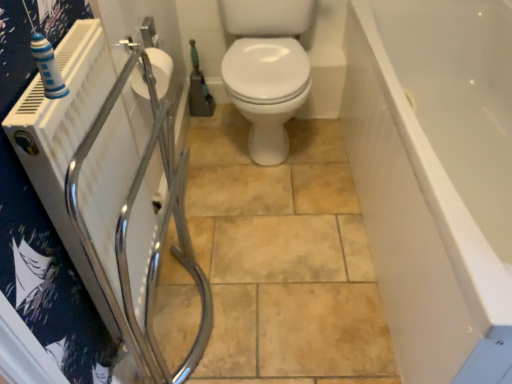
Question: Is green rubber garden hose at center oriented towards white matte toilet paper at upper left?

Choices:
 (A) no
 (B) yes

Answer: (B)

Question: From a real-world perspective, is green rubber garden hose at center on top of white matte toilet paper at upper left?

Choices:
 (A) no
 (B) yes

Answer: (A)

Question: Would you consider green rubber garden hose at center to be distant from white matte toilet paper at upper left?

Choices:
 (A) yes
 (B) no

Answer: (B)

Question: From the image's perspective, is green rubber garden hose at center on top of white matte toilet paper at upper left?

Choices:
 (A) yes
 (B) no

Answer: (A)

Question: Considering the relative sizes of green rubber garden hose at center and white matte toilet paper at upper left in the image provided, is green rubber garden hose at center taller than white matte toilet paper at upper left?

Choices:
 (A) yes
 (B) no

Answer: (A)

Question: Considering the relative sizes of green rubber garden hose at center and white matte toilet paper at upper left in the image provided, is green rubber garden hose at center thinner than white matte toilet paper at upper left?

Choices:
 (A) no
 (B) yes

Answer: (B)

Question: Does white matte toilet paper at upper left lie in front of white glossy bathtub at right?

Choices:
 (A) yes
 (B) no

Answer: (B)

Question: Can you confirm if white matte toilet paper at upper left is positioned to the right of white glossy bathtub at right?

Choices:
 (A) no
 (B) yes

Answer: (A)

Question: From the image's perspective, is white matte toilet paper at upper left under white glossy bathtub at right?

Choices:
 (A) yes
 (B) no

Answer: (B)

Question: From the image's perspective, is white matte toilet paper at upper left above white glossy bathtub at right?

Choices:
 (A) no
 (B) yes

Answer: (B)

Question: From a real-world perspective, is white matte toilet paper at upper left physically above white glossy bathtub at right?

Choices:
 (A) yes
 (B) no

Answer: (A)

Question: Does white matte toilet paper at upper left have a lesser height compared to white glossy bathtub at right?

Choices:
 (A) yes
 (B) no

Answer: (A)

Question: From the image's perspective, is green rubber garden hose at center located beneath white glossy bathtub at right?

Choices:
 (A) yes
 (B) no

Answer: (B)